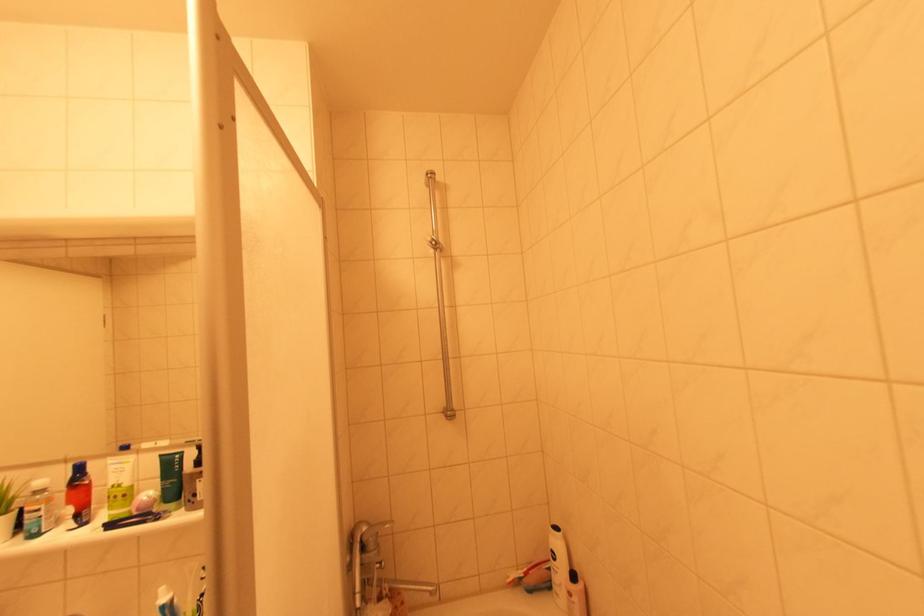
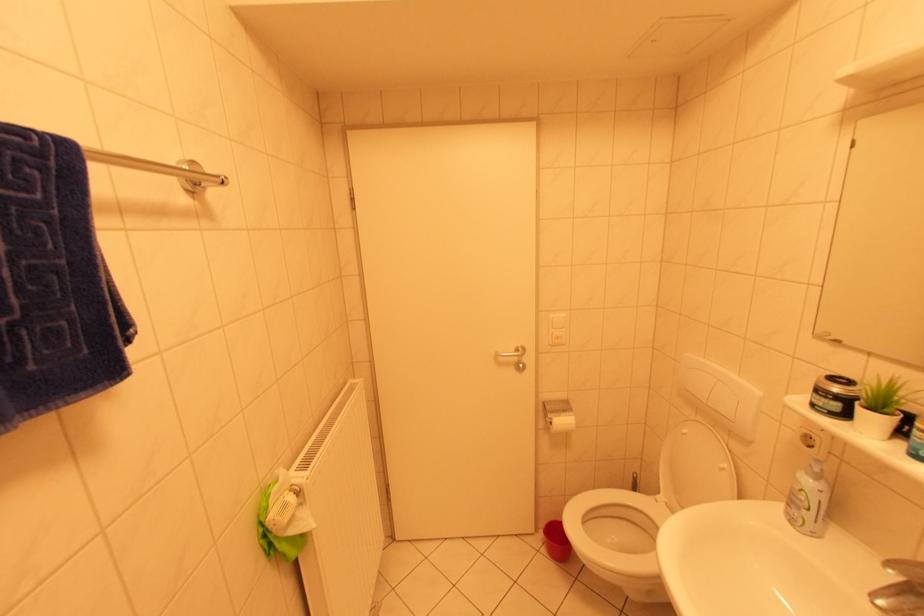
How did the camera likely rotate?

The rotation direction of the camera is left-down.